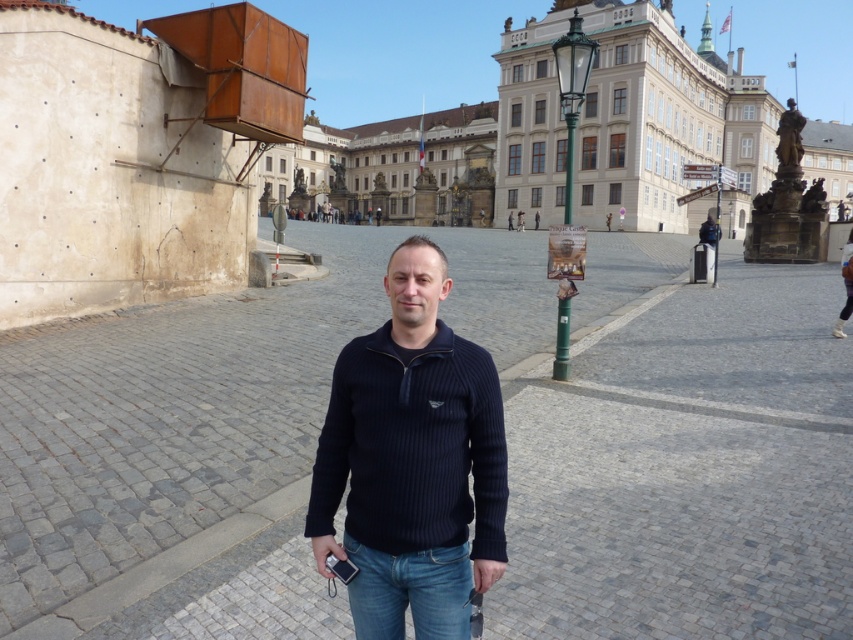
Question: Which point is closer to the camera taking this photo?

Choices:
 (A) (363, 593)
 (B) (410, 538)

Answer: (B)

Question: Is dark blue ribbed sweater at center positioned before blue denim jeans at center?

Choices:
 (A) no
 (B) yes

Answer: (A)

Question: Which object appears closest to the camera in this image?

Choices:
 (A) blue denim jeans at center
 (B) dark blue ribbed sweater at center

Answer: (A)

Question: Where is dark blue ribbed sweater at center located in relation to blue denim jeans at center in the image?

Choices:
 (A) below
 (B) above

Answer: (B)

Question: Which of the following is the closest to the observer?

Choices:
 (A) blue denim jeans at center
 (B) dark blue ribbed sweater at center

Answer: (A)

Question: Can you confirm if dark blue ribbed sweater at center is thinner than blue denim jeans at center?

Choices:
 (A) no
 (B) yes

Answer: (A)